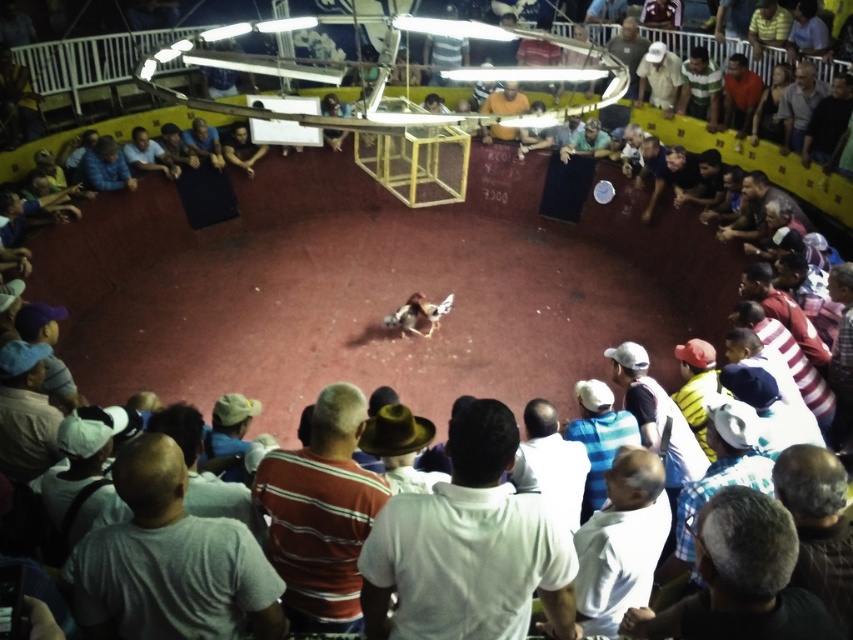
Question: Which object appears closest to the camera in this image?

Choices:
 (A) matte black shirt at upper left
 (B) gray t-shirt at lower left
 (C) white cotton shirt at upper right

Answer: (B)

Question: Observing the image, what is the correct spatial positioning of white cotton shirt at center in reference to gray fabric shirt at upper right?

Choices:
 (A) below
 (B) above

Answer: (A)

Question: Is striped cotton shirt at center in front of white cotton shirt at upper right?

Choices:
 (A) no
 (B) yes

Answer: (B)

Question: Which object is positioned farthest from the gray hair at lower right?

Choices:
 (A) blue fabric at left
 (B) gray t-shirt at lower left

Answer: (A)

Question: Which object appears farthest from the camera in this image?

Choices:
 (A) matte black shirt at upper left
 (B) gray fabric shirt at upper right
 (C) orange shirt at upper right
 (D) green striped shirt at upper right

Answer: (D)

Question: Does striped cotton shirt at center appear over blue shirt at upper left?

Choices:
 (A) yes
 (B) no

Answer: (B)